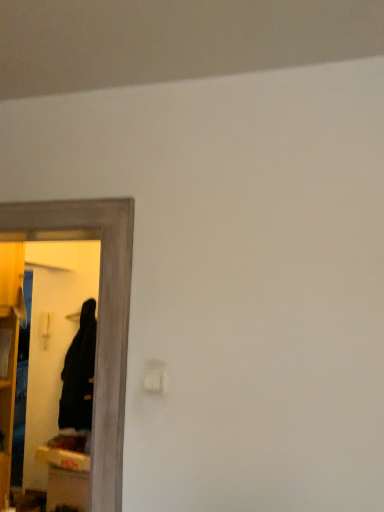
Question: Is black matte robe at left positioned with its back to black matte mirror at left?

Choices:
 (A) yes
 (B) no

Answer: (B)

Question: From the image's perspective, is black matte robe at left located beneath black matte mirror at left?

Choices:
 (A) no
 (B) yes

Answer: (B)

Question: Is black matte robe at left closer to the viewer compared to black matte mirror at left?

Choices:
 (A) no
 (B) yes

Answer: (A)

Question: Considering the relative positions of black matte robe at left and black matte mirror at left in the image provided, is black matte robe at left to the left of black matte mirror at left from the viewer's perspective?

Choices:
 (A) no
 (B) yes

Answer: (B)

Question: Is black matte robe at left oriented towards black matte mirror at left?

Choices:
 (A) no
 (B) yes

Answer: (A)

Question: Is black matte robe at left further to camera compared to black matte mirror at left?

Choices:
 (A) yes
 (B) no

Answer: (A)

Question: From the image's perspective, is black matte mirror at left below black matte robe at left?

Choices:
 (A) no
 (B) yes

Answer: (A)

Question: Considering the relative sizes of black matte mirror at left and black matte robe at left in the image provided, is black matte mirror at left taller than black matte robe at left?

Choices:
 (A) yes
 (B) no

Answer: (A)

Question: Can you confirm if black matte mirror at left is positioned to the left of black matte robe at left?

Choices:
 (A) no
 (B) yes

Answer: (A)

Question: From a real-world perspective, is black matte mirror at left physically below black matte robe at left?

Choices:
 (A) no
 (B) yes

Answer: (A)

Question: Is black matte mirror at left further to the viewer compared to black matte robe at left?

Choices:
 (A) no
 (B) yes

Answer: (A)

Question: Can you confirm if black matte mirror at left is bigger than black matte robe at left?

Choices:
 (A) no
 (B) yes

Answer: (A)

Question: Considering the positions of black matte robe at left and black matte mirror at left in the image, is black matte robe at left wider or thinner than black matte mirror at left?

Choices:
 (A) thin
 (B) wide

Answer: (B)